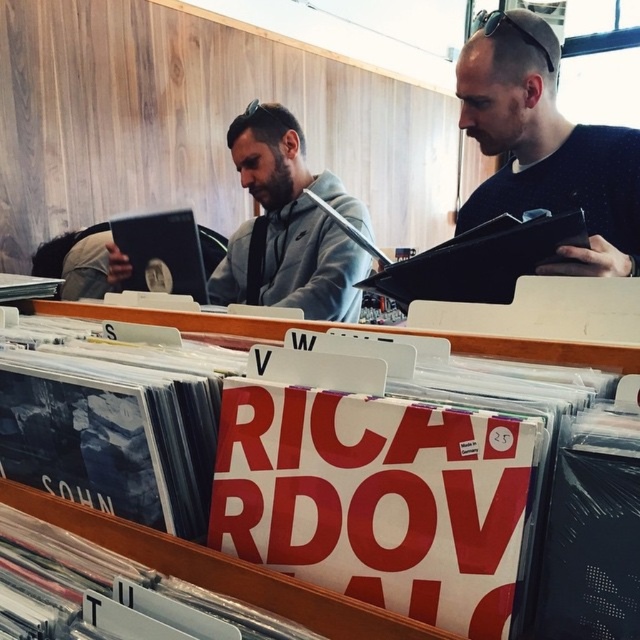
You are standing in the record store and want to know which of the two points, point (570, 412) or point (547, 49), is closer to you. Based on the scene, which point is nearer?

Point (570, 412) is closer to the camera than point (547, 49), so it is nearer to you.

You are a customer in the record store and want to pick up the gray matte hoodie at center. However, there is a white plastic record case at center in your way. Can you reach the hoodie without moving the record case?

The white plastic record case at center is closer to the viewer than the gray matte hoodie at center, so you can reach the hoodie without moving the record case because it is further away.

You are a customer in the record store and want to place the white plastic record case at center on top of the black matte book at upper right. Can you do this without the record case falling off?

The white plastic record case at center is shorter than the black matte book at upper right, so it will not fall off if placed on top since it is smaller in height.